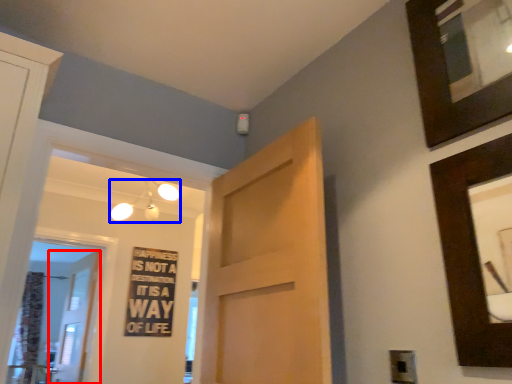
Question: Which object appears closest to the camera in this image, door (highlighted by a red box) or light fixture (highlighted by a blue box)?

Choices:
 (A) door
 (B) light fixture

Answer: (B)